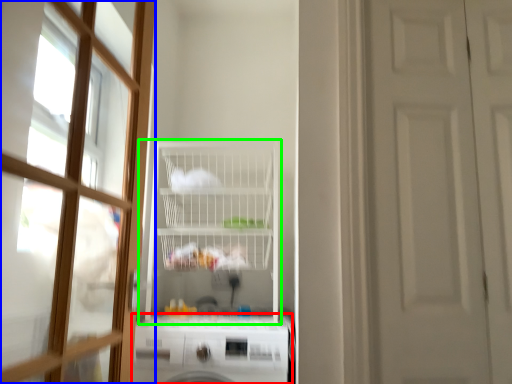
Question: Which is nearer to the dish washer (highlighted by a red box)? door (highlighted by a blue box) or shelf (highlighted by a green box).

Choices:
 (A) door
 (B) shelf

Answer: (B)